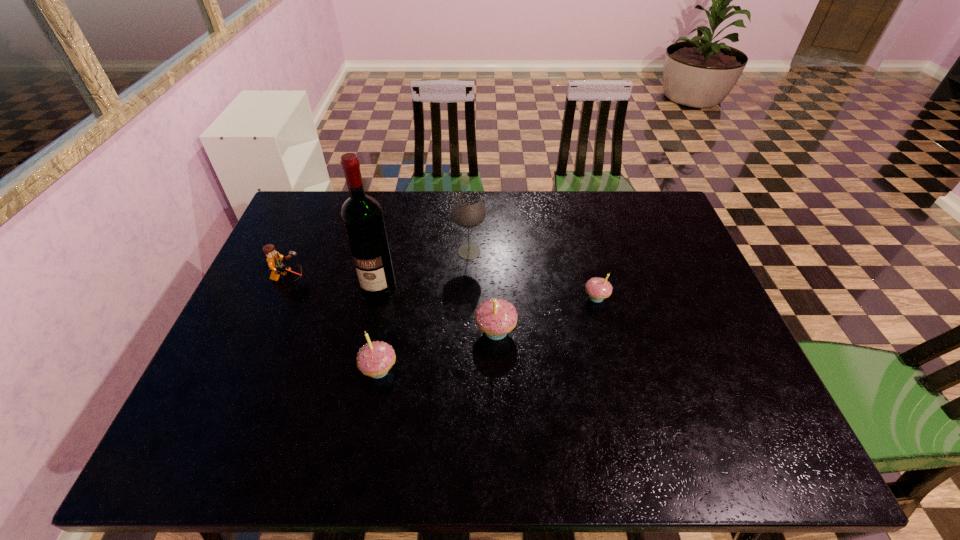
Image resolution: width=960 pixels, height=540 pixels. What are the coordinates of `blank space located on the left of the leftmost cupcake` in the screenshot? It's located at (238, 370).

Identify the location of vacant space situated on the left of the tallest cupcake. The image size is (960, 540). (334, 331).

At what (x,y) coordinates should I click in order to perform the action: click on vacant area situated 0.050m on the back of the rightmost object. Please return your answer as a coordinate pair (x, y). The image size is (960, 540). Looking at the image, I should click on tap(591, 275).

Image resolution: width=960 pixels, height=540 pixels. I want to click on vacant position located 0.380m holding a crossbow in the hands of the leftmost object, so click(x=441, y=279).

You are a GUI agent. You are given a task and a screenshot of the screen. Output one action in this format:
    pyautogui.click(x=<x>, y=<y>)
    Task: Click on the vacant space located on the front and back of the tallest object
    The width and height of the screenshot is (960, 540).
    Given the screenshot: What is the action you would take?
    pyautogui.click(x=364, y=348)

Where is `vacant point located 0.050m on the front of the second tallest object`? vacant point located 0.050m on the front of the second tallest object is located at coordinates (468, 275).

This screenshot has width=960, height=540. In order to click on object that is at the near edge in this screenshot , I will do `click(375, 359)`.

In order to click on object present at the left edge in this screenshot , I will do `click(274, 259)`.

This screenshot has width=960, height=540. Find the location of `vacant space at the far edge`. vacant space at the far edge is located at coordinates (562, 214).

You are a GUI agent. You are given a task and a screenshot of the screen. Output one action in this format:
    pyautogui.click(x=<x>, y=<y>)
    Task: Click on the vacant area at the near edge
    The width and height of the screenshot is (960, 540).
    Given the screenshot: What is the action you would take?
    pyautogui.click(x=605, y=405)